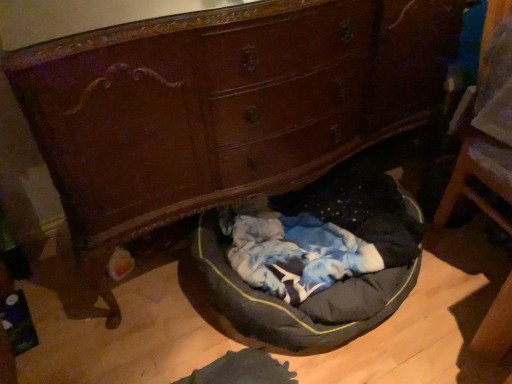
Question: Is black fabric dog bed at center in front of or behind wooden chair at right in the image?

Choices:
 (A) front
 (B) behind

Answer: (B)

Question: Considering the positions of black fabric dog bed at center and wooden chair at right in the image, is black fabric dog bed at center taller or shorter than wooden chair at right?

Choices:
 (A) tall
 (B) short

Answer: (B)

Question: Considering the positions of black fabric dog bed at center and wooden chair at right in the image, is black fabric dog bed at center wider or thinner than wooden chair at right?

Choices:
 (A) wide
 (B) thin

Answer: (A)

Question: Is wooden chair at right wider or thinner than black fabric dog bed at center?

Choices:
 (A) wide
 (B) thin

Answer: (B)

Question: Is wooden chair at right taller or shorter than black fabric dog bed at center?

Choices:
 (A) short
 (B) tall

Answer: (B)

Question: Relative to black fabric dog bed at center, is wooden chair at right in front or behind?

Choices:
 (A) behind
 (B) front

Answer: (B)

Question: Does point (461, 117) appear closer or farther from the camera than point (229, 304)?

Choices:
 (A) farther
 (B) closer

Answer: (A)